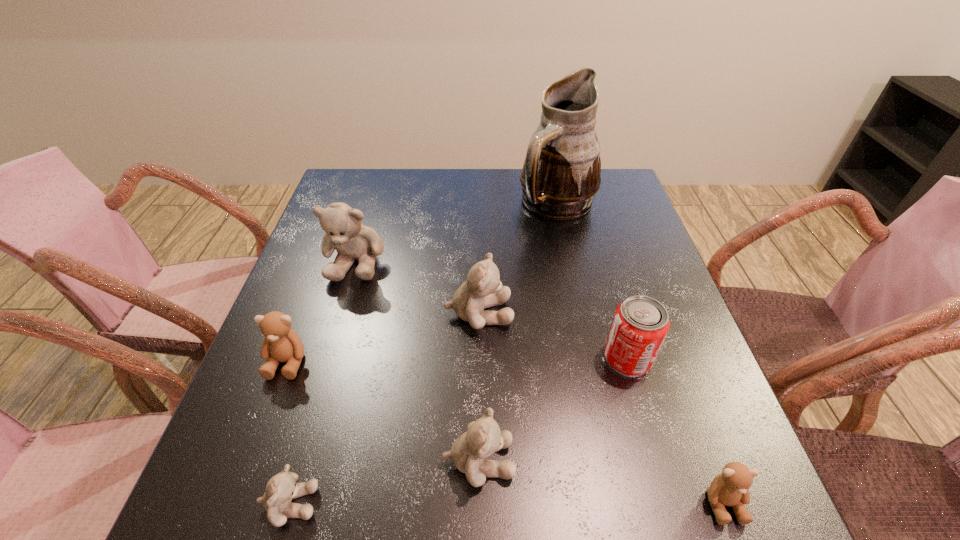
Locate an element on the screen. This screenshot has width=960, height=540. free spot between the smallest gray teddy bear and the second farthest gray teddy bear is located at coordinates (384, 408).

Where is `the third closest object to the can`? The image size is (960, 540). the third closest object to the can is located at coordinates (483, 438).

Locate which object ranks fourth in proximity to the third farthest object. Please provide its 2D coordinates. Your answer should be formatted as a tuple, i.e. [(x, y)], where the tuple contains the x and y coordinates of a point satisfying the conditions above.

[(561, 173)]

Choose which teddy bear is the fourth nearest neighbor to the farther brown teddy bear. Please provide its 2D coordinates. Your answer should be formatted as a tuple, i.e. [(x, y)], where the tuple contains the x and y coordinates of a point satisfying the conditions above.

[(483, 438)]

Where is `teddy bear that can be found as the fourth closest to the second smallest gray teddy bear`? Image resolution: width=960 pixels, height=540 pixels. teddy bear that can be found as the fourth closest to the second smallest gray teddy bear is located at coordinates (281, 344).

This screenshot has height=540, width=960. Find the location of `gray teddy bear that is the fourth closest to the can`. gray teddy bear that is the fourth closest to the can is located at coordinates (x=280, y=490).

The image size is (960, 540). What are the coordinates of `the fourth closest gray teddy bear to the left brown teddy bear` in the screenshot? It's located at (483, 438).

Locate an element on the screen. free spot that satisfies the following two spatial constraints: 1. from the spout of the brown pitcher; 2. on the face of the smallest gray teddy bear is located at coordinates (622, 503).